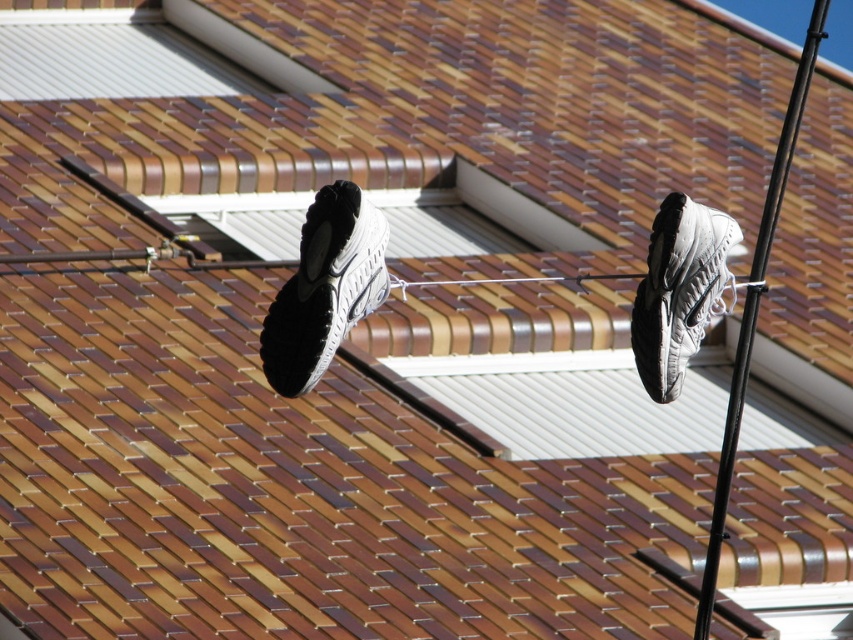
You are a delivery person who needs to determine which shoe is smaller to ensure it fits into a small delivery box. You see the white matte shoe at center and the gray fabric shoe at upper right. Which one should you choose?

The white matte shoe at center has a smaller size compared to the gray fabric shoe at upper right, so you should choose the white matte shoe at center to fit into the small delivery box.

You are a delivery person who needs to check the status of two shoes hanging on a clothesline. The shoes are the white matte shoe at center and the gray fabric shoe at upper right. According to the scene, which shoe is positioned higher?

The white matte shoe at center is located above the gray fabric shoe at upper right, so it is positioned higher.